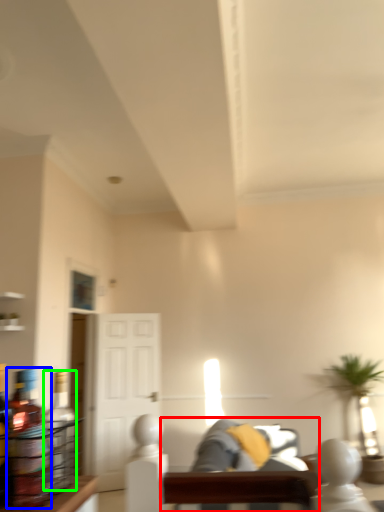
Question: Which object is positioned closest to couch (highlighted by a red box)? Select from bottle (highlighted by a blue box) and bottle (highlighted by a green box).

Choices:
 (A) bottle
 (B) bottle

Answer: (B)